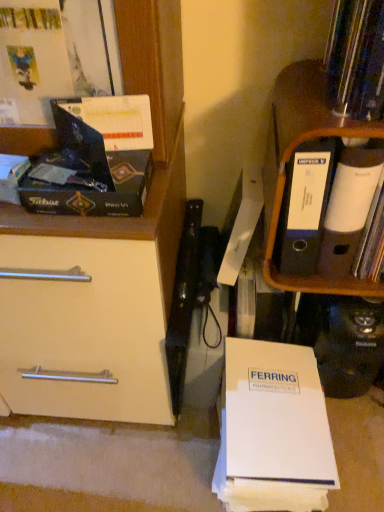
Question: Is white paper at upper right, the 1th paperback book positioned from the right, thinner than matte black book at upper left?

Choices:
 (A) yes
 (B) no

Answer: (B)

Question: Is white paper at upper right, which is the second paperback book from top to bottom, positioned behind matte black book at upper left?

Choices:
 (A) yes
 (B) no

Answer: (A)

Question: Is white paper at upper right, which is the second paperback book from top to bottom, oriented away from matte black book at upper left?

Choices:
 (A) yes
 (B) no

Answer: (B)

Question: From the image's perspective, is white paper at upper right, which is the second paperback book from top to bottom, beneath matte black book at upper left?

Choices:
 (A) no
 (B) yes

Answer: (A)

Question: From the image's perspective, is white paper at upper right, arranged as the 2th paperback book when ordered from the bottom, on matte black book at upper left?

Choices:
 (A) yes
 (B) no

Answer: (A)

Question: Is matte black box at left taller or shorter than white paper at lower center, the first paperback book when ordered from bottom to top?

Choices:
 (A) short
 (B) tall

Answer: (A)

Question: Do you think matte black box at left is within white paper at lower center, which is counted as the third paperback book, starting from the top, or outside of it?

Choices:
 (A) inside
 (B) outside

Answer: (B)

Question: From a real-world perspective, is matte black box at left physically located above or below white paper at lower center, which is counted as the third paperback book, starting from the top?

Choices:
 (A) below
 (B) above

Answer: (B)

Question: From the image's perspective, relative to white paper at lower center, which is counted as the third paperback book, starting from the top, is matte black box at left above or below?

Choices:
 (A) below
 (B) above

Answer: (B)

Question: Is white paper at lower center, the first paperback book when ordered from bottom to top, spatially inside matte black box at left, or outside of it?

Choices:
 (A) inside
 (B) outside

Answer: (B)

Question: From a real-world perspective, is white paper at lower center, the first paperback book when ordered from bottom to top, physically located above or below matte black box at left?

Choices:
 (A) above
 (B) below

Answer: (B)

Question: From the image's perspective, is white paper at lower center, which is counted as the third paperback book, starting from the top, located above or below matte black box at left?

Choices:
 (A) above
 (B) below

Answer: (B)

Question: From their relative heights in the image, would you say white paper at lower center, which is counted as the third paperback book, starting from the top, is taller or shorter than matte black box at left?

Choices:
 (A) tall
 (B) short

Answer: (A)

Question: Looking at the image, does orange wood shelf at right seem bigger or smaller compared to white paper at upper right, which is the second paperback book from top to bottom?

Choices:
 (A) big
 (B) small

Answer: (A)

Question: Is point coord(306,95) closer or farther from the camera than point coord(342,167)?

Choices:
 (A) closer
 (B) farther

Answer: (A)